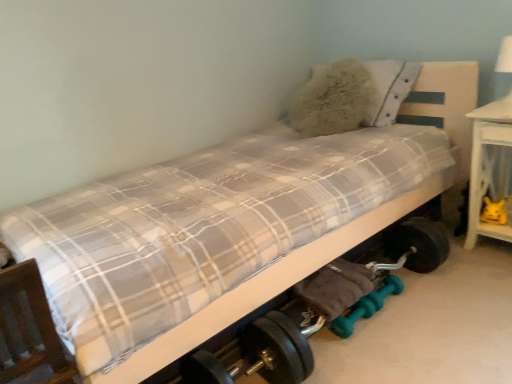
Question: Is wooden bed frame at lower left a part of white glossy table lamp at upper right?

Choices:
 (A) yes
 (B) no

Answer: (B)

Question: Is white glossy table lamp at upper right thinner than wooden bed frame at lower left?

Choices:
 (A) yes
 (B) no

Answer: (B)

Question: Is white glossy table lamp at upper right far from wooden bed frame at lower left?

Choices:
 (A) yes
 (B) no

Answer: (A)

Question: From the image's perspective, is white glossy table lamp at upper right under wooden bed frame at lower left?

Choices:
 (A) yes
 (B) no

Answer: (B)

Question: Can you confirm if white glossy table lamp at upper right is smaller than wooden bed frame at lower left?

Choices:
 (A) yes
 (B) no

Answer: (A)

Question: From a real-world perspective, is white glossy table lamp at upper right positioned over wooden bed frame at lower left based on gravity?

Choices:
 (A) yes
 (B) no

Answer: (A)

Question: From the image's perspective, is fluffy white pillow at upper right located above wooden bed frame at lower left?

Choices:
 (A) no
 (B) yes

Answer: (B)

Question: Would you consider fluffy white pillow at upper right to be distant from wooden bed frame at lower left?

Choices:
 (A) yes
 (B) no

Answer: (A)

Question: Does fluffy white pillow at upper right have a larger size compared to wooden bed frame at lower left?

Choices:
 (A) yes
 (B) no

Answer: (B)

Question: Is fluffy white pillow at upper right turned away from wooden bed frame at lower left?

Choices:
 (A) no
 (B) yes

Answer: (A)

Question: Is fluffy white pillow at upper right completely or partially outside of wooden bed frame at lower left?

Choices:
 (A) yes
 (B) no

Answer: (A)

Question: Can you confirm if fluffy white pillow at upper right is positioned to the right of wooden bed frame at lower left?

Choices:
 (A) yes
 (B) no

Answer: (A)

Question: Can you confirm if wooden bed frame at lower left is taller than teal rubber dumbbells at lower center?

Choices:
 (A) yes
 (B) no

Answer: (A)